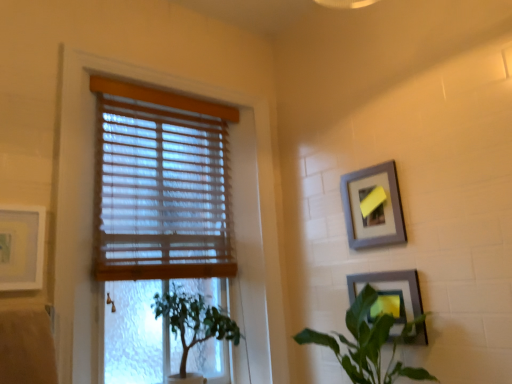
Question: Considering the relative positions of wooden blinds at left and green leafy plant at lower right, positioned as the 2th houseplant in left-to-right order, in the image provided, is wooden blinds at left to the right of green leafy plant at lower right, positioned as the 2th houseplant in left-to-right order, from the viewer's perspective?

Choices:
 (A) yes
 (B) no

Answer: (B)

Question: Is wooden blinds at left not near green leafy plant at lower right, positioned as the 2th houseplant in left-to-right order?

Choices:
 (A) no
 (B) yes

Answer: (A)

Question: From a real-world perspective, is wooden blinds at left located beneath green leafy plant at lower right, positioned as the 2th houseplant in left-to-right order?

Choices:
 (A) no
 (B) yes

Answer: (A)

Question: Does wooden blinds at left have a smaller size compared to green leafy plant at lower right, which is the 1th houseplant from right to left?

Choices:
 (A) yes
 (B) no

Answer: (B)

Question: From the image's perspective, is wooden blinds at left beneath green leafy plant at lower right, positioned as the 2th houseplant in left-to-right order?

Choices:
 (A) yes
 (B) no

Answer: (B)

Question: From a real-world perspective, is green leafy plant at lower right, positioned as the 2th houseplant in left-to-right order, physically located above or below green leafy plant at lower left, which ranks as the 2th houseplant in right-to-left order?

Choices:
 (A) below
 (B) above

Answer: (A)

Question: In terms of width, does green leafy plant at lower right, positioned as the 2th houseplant in left-to-right order, look wider or thinner when compared to green leafy plant at lower left, the first houseplant in the left-to-right sequence?

Choices:
 (A) wide
 (B) thin

Answer: (B)

Question: Is green leafy plant at lower right, positioned as the 2th houseplant in left-to-right order, situated inside green leafy plant at lower left, the first houseplant in the left-to-right sequence, or outside?

Choices:
 (A) inside
 (B) outside

Answer: (B)

Question: Is point (423, 372) positioned closer to the camera than point (179, 317)?

Choices:
 (A) closer
 (B) farther

Answer: (A)

Question: From a real-world perspective, is gray matte picture frame at upper right, the second picture frame when ordered from left to right, above or below wooden blinds at left?

Choices:
 (A) below
 (B) above

Answer: (B)

Question: Would you say gray matte picture frame at upper right, the second picture frame when ordered from left to right, is inside or outside wooden blinds at left?

Choices:
 (A) inside
 (B) outside

Answer: (B)

Question: Would you say gray matte picture frame at upper right, the second picture frame positioned from the right, is to the left or to the right of wooden blinds at left in the picture?

Choices:
 (A) right
 (B) left

Answer: (A)

Question: Is gray matte picture frame at upper right, the second picture frame when ordered from left to right, taller or shorter than wooden blinds at left?

Choices:
 (A) tall
 (B) short

Answer: (B)

Question: Relative to green leafy plant at lower left, the first houseplant in the left-to-right sequence, is wooden blinds at upper left in front or behind?

Choices:
 (A) front
 (B) behind

Answer: (B)

Question: From the image's perspective, is wooden blinds at upper left above or below green leafy plant at lower left, the first houseplant in the left-to-right sequence?

Choices:
 (A) above
 (B) below

Answer: (A)